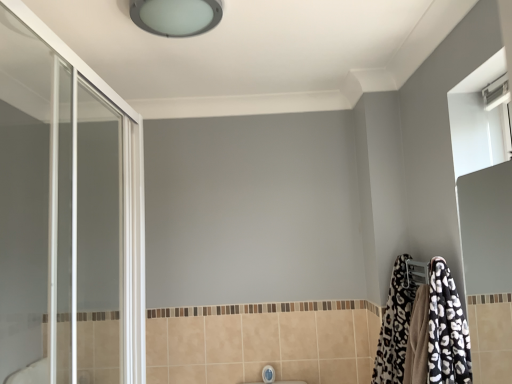
Question: Which is correct: transparent glass screen door at left is inside satin white ceiling light at upper center, or outside of it?

Choices:
 (A) inside
 (B) outside

Answer: (B)

Question: Is point [53, 367] closer or farther from the camera than point [157, 21]?

Choices:
 (A) farther
 (B) closer

Answer: (B)

Question: Which of these objects is positioned closest to the black and white leopard print bathrobe at lower right?

Choices:
 (A) transparent glass screen door at left
 (B) white glossy faucet at lower center
 (C) satin white ceiling light at upper center

Answer: (B)

Question: Which is nearer to the black and white leopard print bathrobe at lower right?

Choices:
 (A) satin white ceiling light at upper center
 (B) transparent glass screen door at left
 (C) white glossy faucet at lower center

Answer: (C)